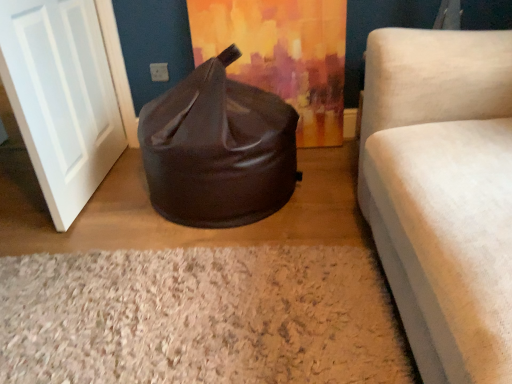
Question: From a real-world perspective, is white matte door at left over brown leather bean bag at center?

Choices:
 (A) no
 (B) yes

Answer: (B)

Question: Is white matte door at left facing away from brown leather bean bag at center?

Choices:
 (A) yes
 (B) no

Answer: (A)

Question: Is white matte door at left outside of brown leather bean bag at center?

Choices:
 (A) no
 (B) yes

Answer: (B)

Question: From the image's perspective, would you say white matte door at left is shown under brown leather bean bag at center?

Choices:
 (A) yes
 (B) no

Answer: (B)

Question: Considering the relative sizes of white matte door at left and brown leather bean bag at center in the image provided, is white matte door at left thinner than brown leather bean bag at center?

Choices:
 (A) yes
 (B) no

Answer: (A)

Question: Does point (296, 104) appear closer or farther from the camera than point (351, 332)?

Choices:
 (A) farther
 (B) closer

Answer: (A)

Question: Would you say brown leather bean bag at center is to the left or to the right of white shaggy rug at lower center in the picture?

Choices:
 (A) right
 (B) left

Answer: (A)

Question: Is brown leather bean bag at center inside the boundaries of white shaggy rug at lower center, or outside?

Choices:
 (A) outside
 (B) inside

Answer: (A)

Question: From the image's perspective, is brown leather bean bag at center above or below white shaggy rug at lower center?

Choices:
 (A) above
 (B) below

Answer: (A)

Question: Would you say white shaggy rug at lower center is to the left or to the right of brown leather bean bag at center in the picture?

Choices:
 (A) right
 (B) left

Answer: (B)

Question: From a real-world perspective, relative to brown leather bean bag at center, is white shaggy rug at lower center vertically above or below?

Choices:
 (A) above
 (B) below

Answer: (B)

Question: Considering the positions of white shaggy rug at lower center and brown leather bean bag at center in the image, is white shaggy rug at lower center wider or thinner than brown leather bean bag at center?

Choices:
 (A) wide
 (B) thin

Answer: (A)

Question: Do you think white shaggy rug at lower center is within brown leather bean bag at center, or outside of it?

Choices:
 (A) inside
 (B) outside

Answer: (B)

Question: From the image's perspective, relative to white matte door at left, is brown leather bean bag at center above or below?

Choices:
 (A) below
 (B) above

Answer: (A)

Question: Is brown leather bean bag at center in front of or behind white matte door at left in the image?

Choices:
 (A) front
 (B) behind

Answer: (B)